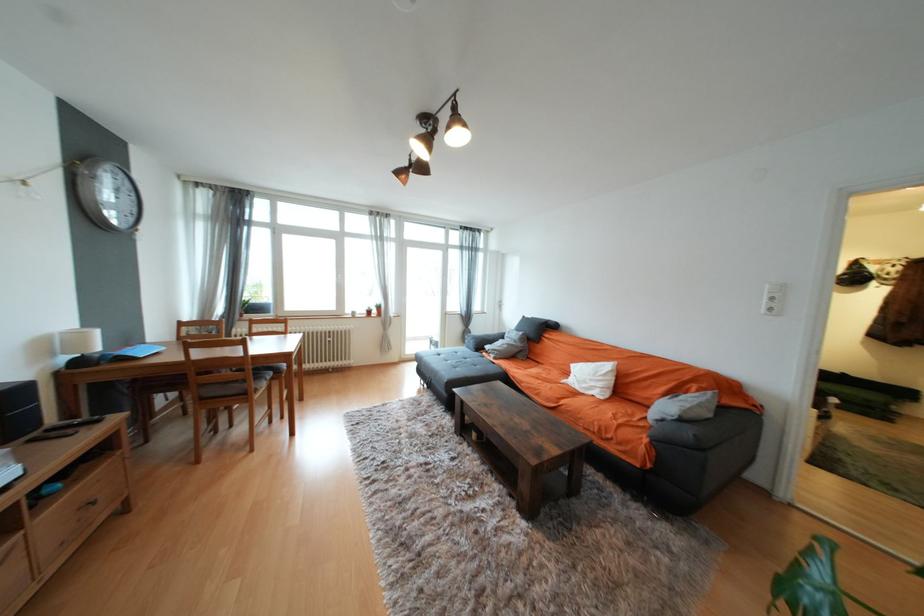
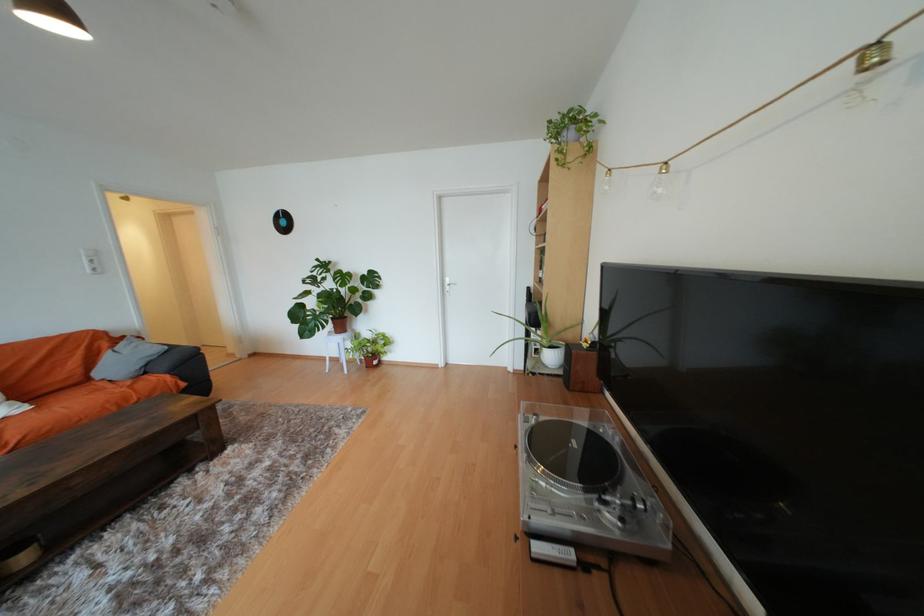
Locate, in the second image, the point that corresponds to (775,310) in the first image.

(101, 270)